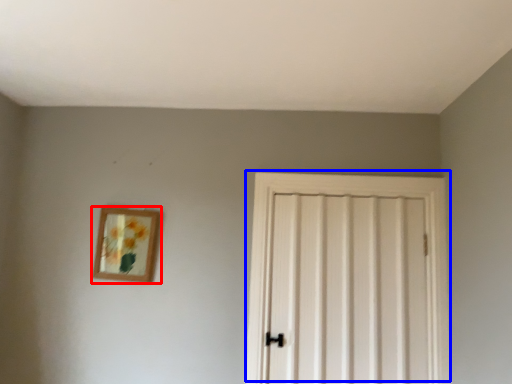
Question: Which object is further to the camera taking this photo, picture frame (highlighted by a red box) or door (highlighted by a blue box)?

Choices:
 (A) picture frame
 (B) door

Answer: (A)